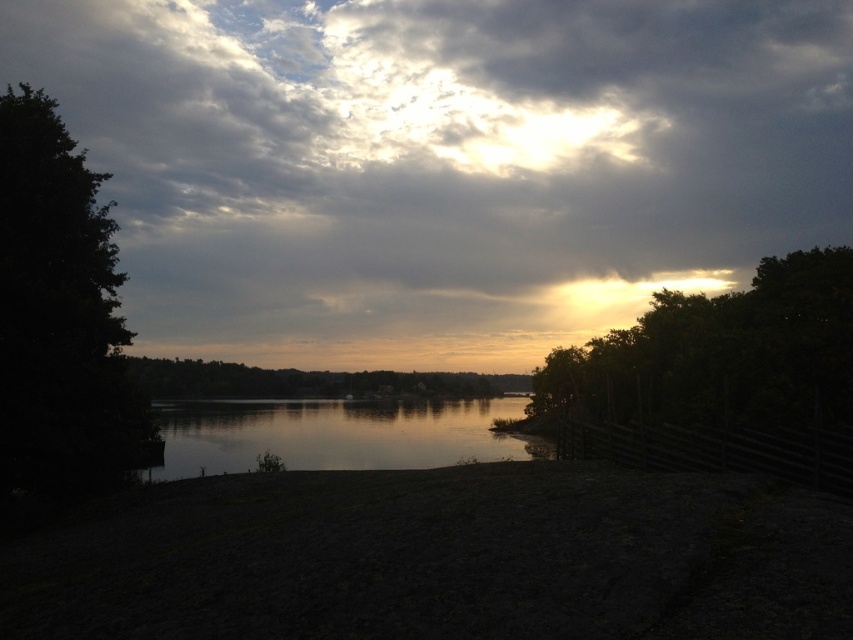
Which is more to the right, silvery metallic tree at upper right or silvery reflective water at center?

silvery metallic tree at upper right

Is silvery metallic tree at upper right wider than silvery reflective water at center?

No, silvery metallic tree at upper right is not wider than silvery reflective water at center.

Which is in front, point (785, 266) or point (248, 452)?

Point (785, 266)

Identify the location of silvery metallic tree at upper right. (718, 353).

Does silvery metallic tree at upper right come in front of green matte tree at center?

Yes, it is.

What do you see at coordinates (718, 353) in the screenshot? I see `silvery metallic tree at upper right` at bounding box center [718, 353].

Between point (769, 273) and point (268, 396), which one is positioned in front?

Positioned in front is point (769, 273).

This screenshot has width=853, height=640. In order to click on silvery metallic tree at upper right in this screenshot , I will do `click(718, 353)`.

Does point (740, 253) come farther from viewer compared to point (3, 275)?

That is True.

Between point (560, 278) and point (111, 339), which one is positioned behind?

The point (560, 278) is behind.

Find the location of a particular element. The width and height of the screenshot is (853, 640). cloudy sky at upper center is located at coordinates (442, 163).